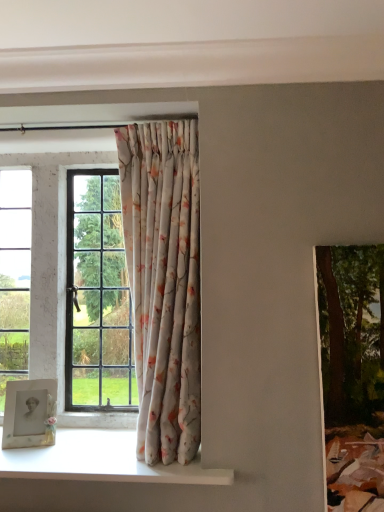
This screenshot has height=512, width=384. In order to click on vacant area on top of floral fabric curtain at center (from a real-world perspective) in this screenshot , I will do `click(162, 116)`.